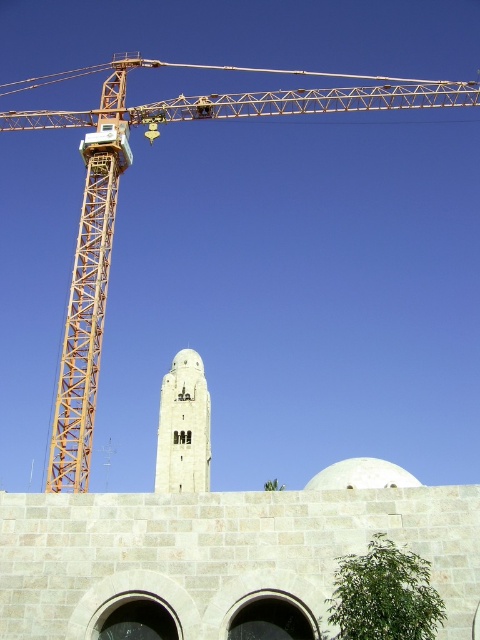
Does orange metallic crane at left appear on the right side of light beige stone bell tower at center?

Yes, orange metallic crane at left is to the right of light beige stone bell tower at center.

Does orange metallic crane at left have a lesser width compared to light beige stone bell tower at center?

No, orange metallic crane at left is not thinner than light beige stone bell tower at center.

Is point (275, 109) farther from camera compared to point (210, 422)?

No, it is not.

At what (x,y) coordinates should I click in order to perform the action: click on orange metallic crane at left. Please return your answer as a coordinate pair (x, y). Looking at the image, I should click on (117, 198).

Is point (178, 422) positioned in front of point (402, 483)?

No.

Who is positioned more to the right, light beige stone bell tower at center or white stone dome at center?

white stone dome at center is more to the right.

Image resolution: width=480 pixels, height=640 pixels. I want to click on light beige stone bell tower at center, so click(183, 428).

This screenshot has height=640, width=480. Find the location of `beige stone wall at lower center`. beige stone wall at lower center is located at coordinates [x=218, y=554].

Which is below, beige stone wall at lower center or light beige stone bell tower at center?

light beige stone bell tower at center is lower down.

Is point (421, 515) closer to viewer compared to point (204, 452)?

Yes, it is.

This screenshot has height=640, width=480. I want to click on beige stone wall at lower center, so click(x=218, y=554).